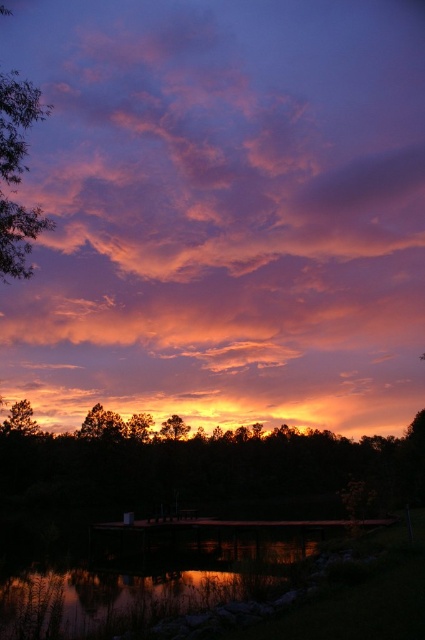
You are standing on the lakeshore and see the dark green leafy tree at center and the green leafy tree at left. Which one is closer to your left side?

The green leafy tree at left is closer to your left side because it is positioned to the left of the dark green leafy tree at center.

You are standing at the point with coordinates point (x=3, y=250) and want to take a photo of the sunset. Is the point point (x=248, y=564) blocking your view of the sunset?

Point 0.884, 084 is behind point 0.392, 009, so it will not block your view of the sunset.

In the scene shown: You are standing at the edge of the lake and notice a point marked at coordinates (204, 467). According to the scene description, what object is located at that point?

The point at coordinates (204, 467) corresponds to the dark green leafy tree at center.